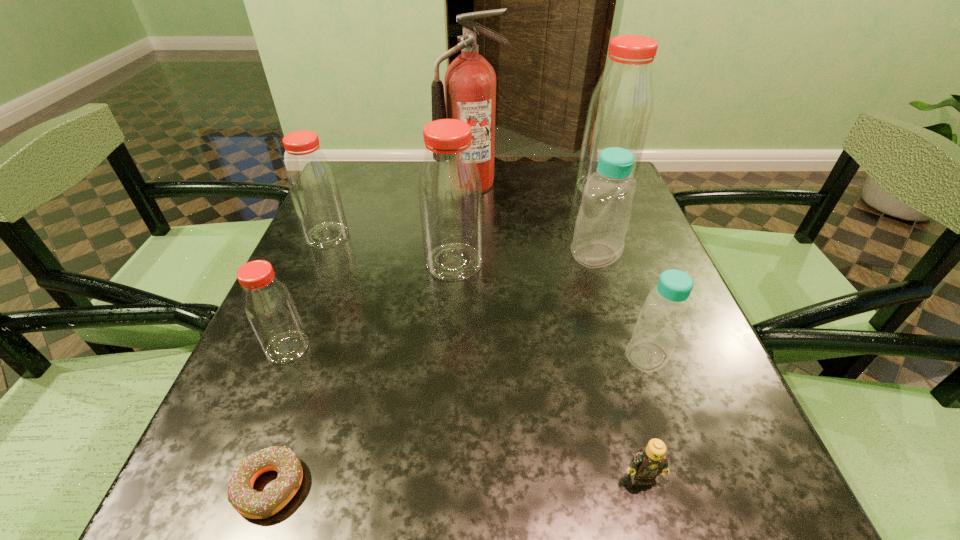
The image size is (960, 540). Find the location of `free spot located 0.230m on the back of the chocolate doughnut`. free spot located 0.230m on the back of the chocolate doughnut is located at coordinates (324, 332).

The height and width of the screenshot is (540, 960). In order to click on fire extinguisher that is at the far edge in this screenshot , I will do `click(470, 81)`.

You are a GUI agent. You are given a task and a screenshot of the screen. Output one action in this format:
    pyautogui.click(x=<x>, y=<y>)
    Task: Click on the bottle positioned at the far edge
    The height and width of the screenshot is (540, 960).
    Given the screenshot: What is the action you would take?
    pyautogui.click(x=619, y=114)

You are a GUI agent. You are given a task and a screenshot of the screen. Output one action in this format:
    pyautogui.click(x=<x>, y=<y>)
    Task: Click on the Lego present at the near edge
    The image size is (960, 540).
    Given the screenshot: What is the action you would take?
    pyautogui.click(x=650, y=461)

You are a GUI agent. You are given a task and a screenshot of the screen. Output one action in this format:
    pyautogui.click(x=<x>, y=<y>)
    Task: Click on the doughnut that is at the near edge
    Image resolution: width=960 pixels, height=540 pixels.
    Given the screenshot: What is the action you would take?
    pyautogui.click(x=250, y=503)

Find the location of a particular element. The image size is (960, 540). doughnut present at the left edge is located at coordinates (250, 503).

This screenshot has height=540, width=960. I want to click on Lego that is at the right edge, so click(x=650, y=461).

At what (x,y) coordinates should I click in order to perform the action: click on object that is positioned at the near left corner. Please return your answer as a coordinate pair (x, y). Image resolution: width=960 pixels, height=540 pixels. Looking at the image, I should click on (250, 503).

What are the coordinates of `object at the far right corner` in the screenshot? It's located at (619, 114).

Locate an element on the screen. The height and width of the screenshot is (540, 960). object located in the near right corner section of the desktop is located at coordinates (650, 461).